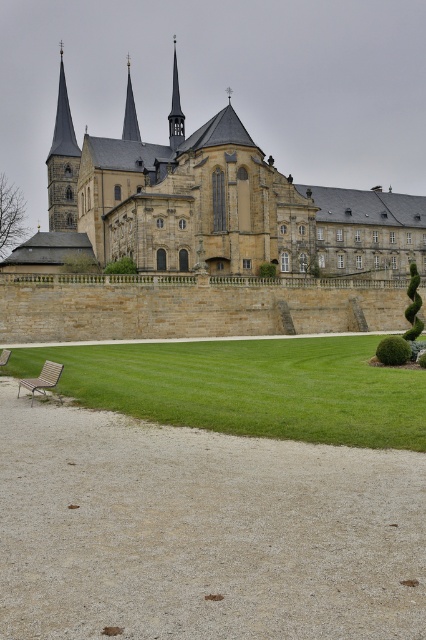
Question: Which of these objects is positioned farthest from the wooden park bench at lower left?

Choices:
 (A) wooden slats bench at lower left
 (B) polished dark gray spire at center
 (C) smooth gold spire at upper left

Answer: (C)

Question: Can you confirm if polished dark gray spire at center is wider than wooden park bench at lower left?

Choices:
 (A) no
 (B) yes

Answer: (B)

Question: Is green grass at center above wooden park bench at lower left?

Choices:
 (A) yes
 (B) no

Answer: (B)

Question: In this image, where is smooth gold spire at upper left located relative to wooden park bench at lower left?

Choices:
 (A) above
 (B) below

Answer: (A)

Question: Which of the following is the farthest from the observer?

Choices:
 (A) (175, 93)
 (B) (245, 412)
 (C) (8, 355)
 (D) (42, 372)

Answer: (A)

Question: Which of the following is the closest to the observer?

Choices:
 (A) polished dark gray spire at center
 (B) smooth gold spire at upper left
 (C) wooden slats bench at lower left
 (D) wooden park bench at lower left

Answer: (C)